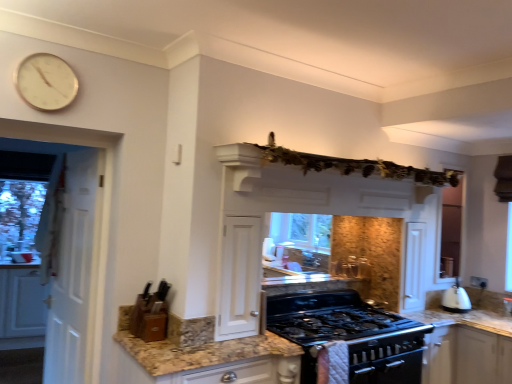
Find the location of a particular element. blank space situated above wooden knife block at lower left, the first appliance in the top-to-bottom sequence (from a real-world perspective) is located at coordinates (153, 289).